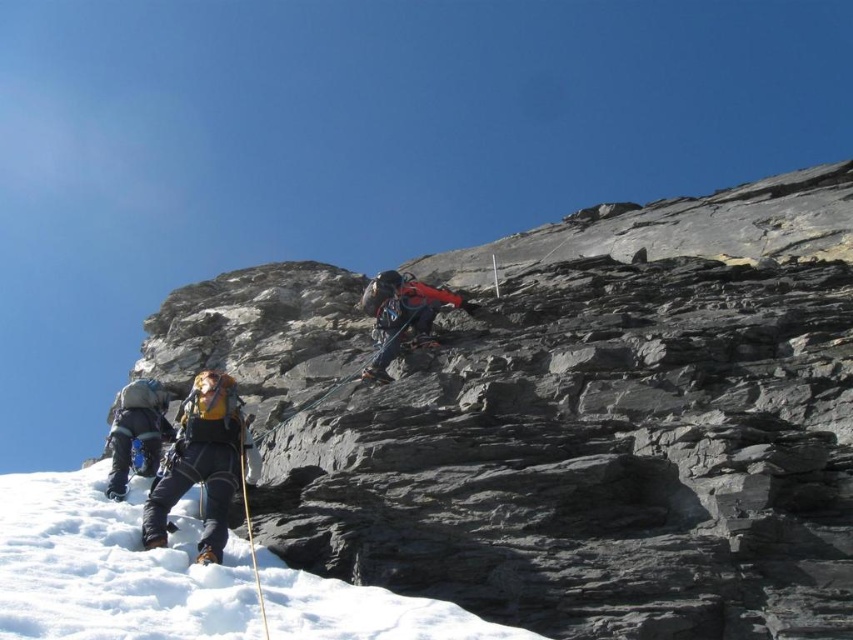
In the scene shown: You are a climber trying to navigate between two points on the cliff. The first point is at coordinate point(88, 467) and the second is at point(204, 451). Which point is closer to the top of the cliff?

Point(204, 451) is closer to the top of the cliff because it is in front of point(88, 467), which is behind it.

You are a climber preparing to ascend the snow slope. You see the white powdery snow at lower left and the matte blue jacket at lower left. Which object is located to the right of the other?

The white powdery snow at lower left is positioned on the right side of matte blue jacket at lower left, so the white powdery snow at lower left is to the right of the matte blue jacket at lower left.

You are a climber preparing to ascend the cliff and need to place your gear on the white powdery snow at lower left before starting. However, there is a matte blue jacket at lower left in the way. Can you easily access the snow area without moving the jacket?

The white powdery snow at lower left is closer to the viewer than the matte blue jacket at lower left, so the snow is in front of the jacket. Therefore, you can easily access the snow area without needing to move the jacket since it is already in front.